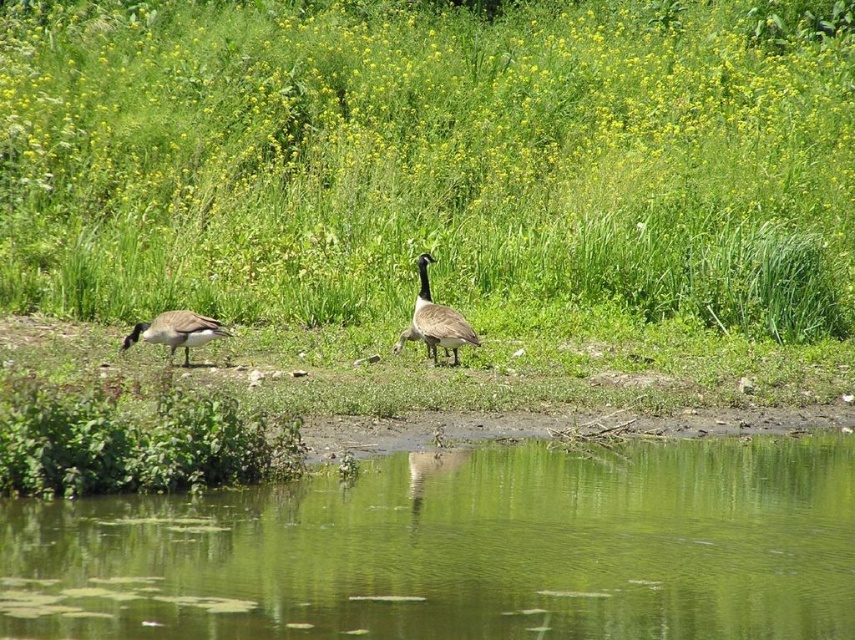
Consider the image. Does green reflective water at center appear under brown feathered goose at center?

Yes, green reflective water at center is below brown feathered goose at center.

In the scene shown: Between green reflective water at center and brown feathered goose at center, which one has less height?

green reflective water at center is shorter.

Between point (183, 577) and point (458, 326), which one is positioned in front?

Point (183, 577) is in front.

The height and width of the screenshot is (640, 855). What are the coordinates of `green reflective water at center` in the screenshot? It's located at (458, 550).

Is green grass at center above brown feathered goose at center?

Yes.

Can you confirm if green grass at center is shorter than brown feathered goose at center?

No, green grass at center is not shorter than brown feathered goose at center.

Who is more distant from viewer, (162,180) or (440,339)?

The point (162,180) is behind.

This screenshot has height=640, width=855. I want to click on green grass at center, so click(x=425, y=157).

Which is behind, point (553, 220) or point (396, 516)?

Positioned behind is point (553, 220).

Can you confirm if green grass at center is wider than green reflective water at center?

Yes.

Is point (458, 76) closer to camera compared to point (295, 579)?

No, (458, 76) is further to viewer.

Where is `green grass at center`? green grass at center is located at coordinates (425, 157).